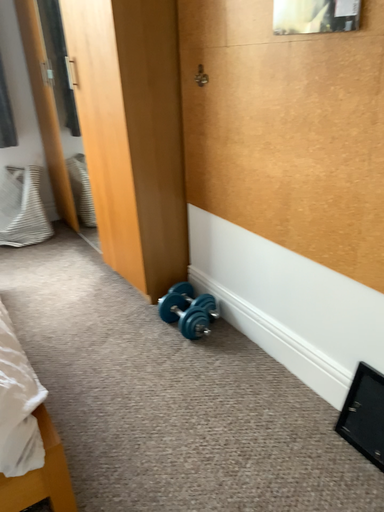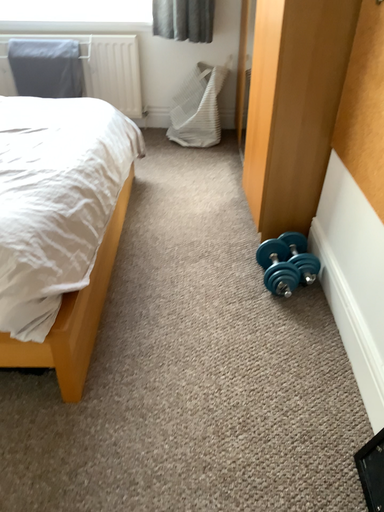
Question: Which way did the camera rotate in the video?

Choices:
 (A) rotated downward
 (B) rotated upward

Answer: (A)